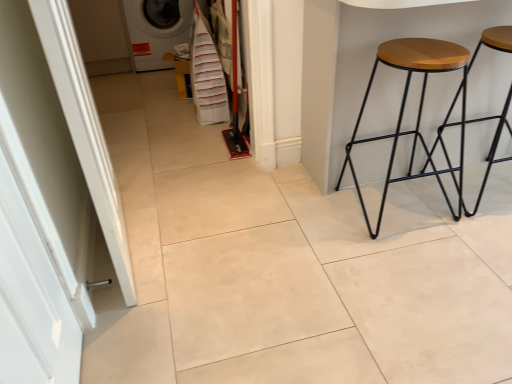
I want to click on free space to the left of wooden/black metal stool at right, the 2th stool when ordered from right to left, so click(x=316, y=214).